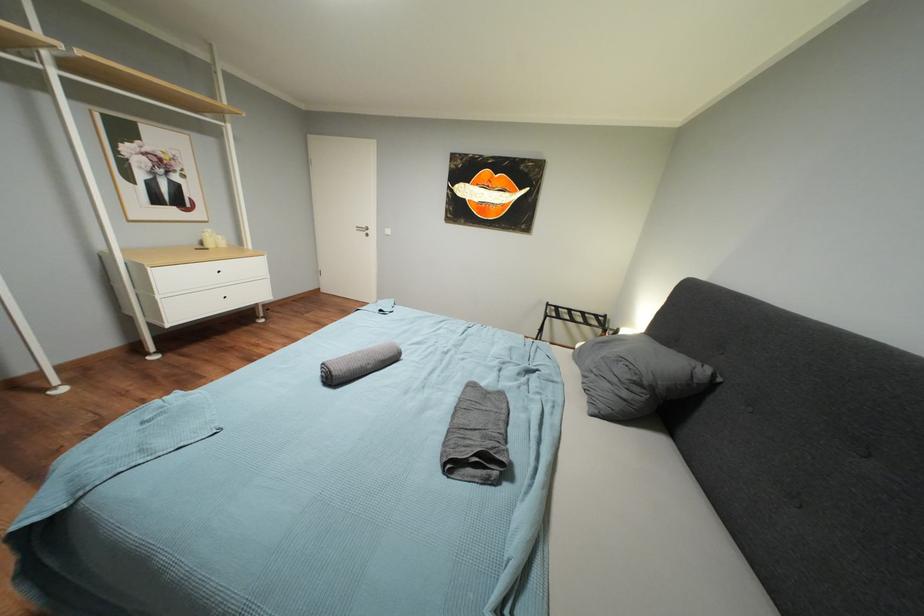
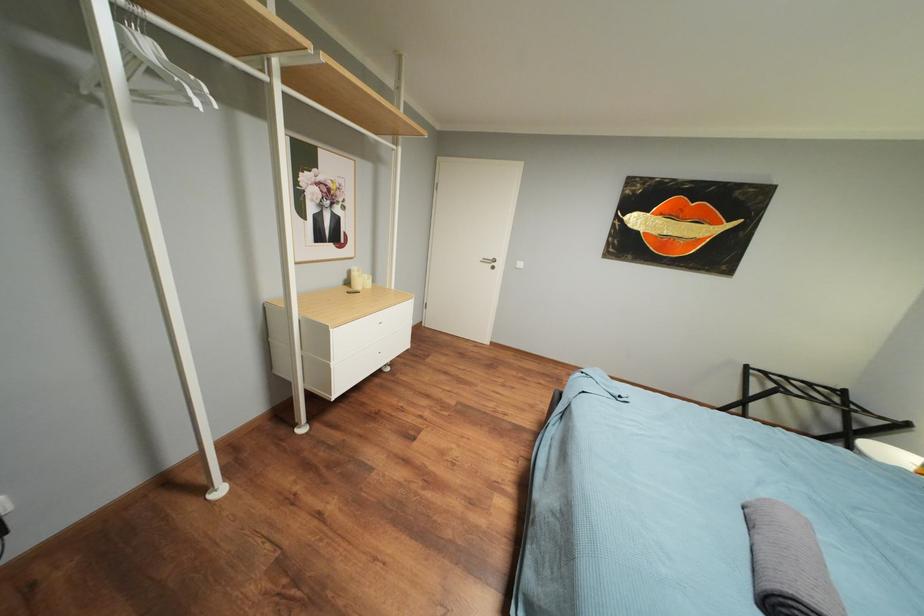
Question: Which direction would the cameraman need to move to produce the second image? Reply with the corresponding letter.

Choices:
 (A) Left
 (B) Right
 (C) Forward
 (D) Backward

Answer: (A)